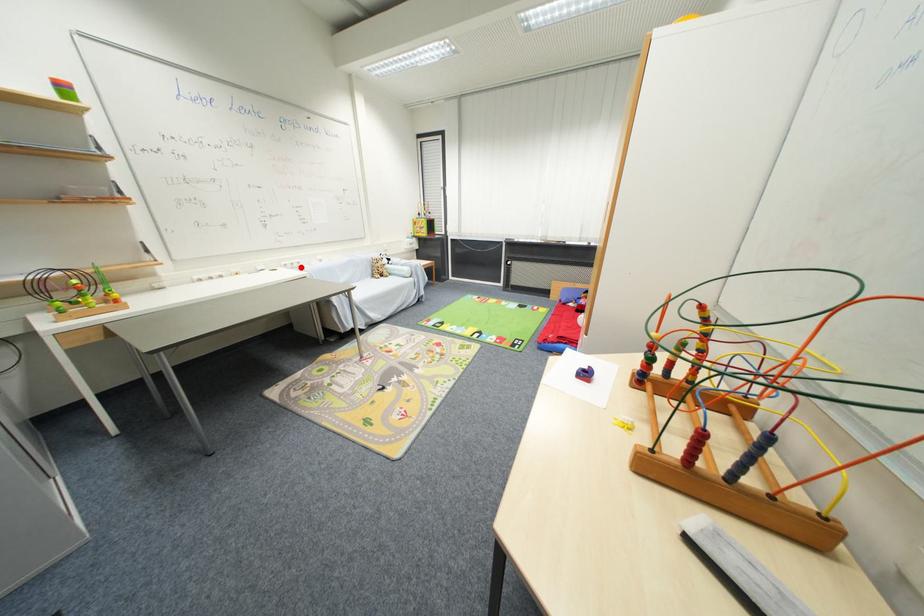
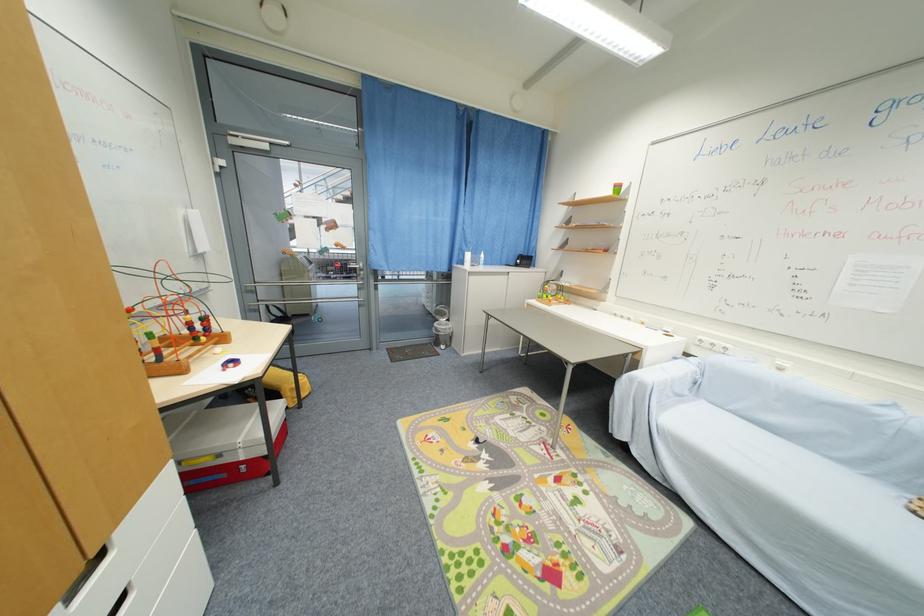
Question: A red point is marked in image1. In image2, is the corresponding 3D point closer to the camera or farther? Reply with the corresponding letter.

Choices:
 (A) The corresponding 3D point is closer.
 (B) The corresponding 3D point is farther.

Answer: (B)